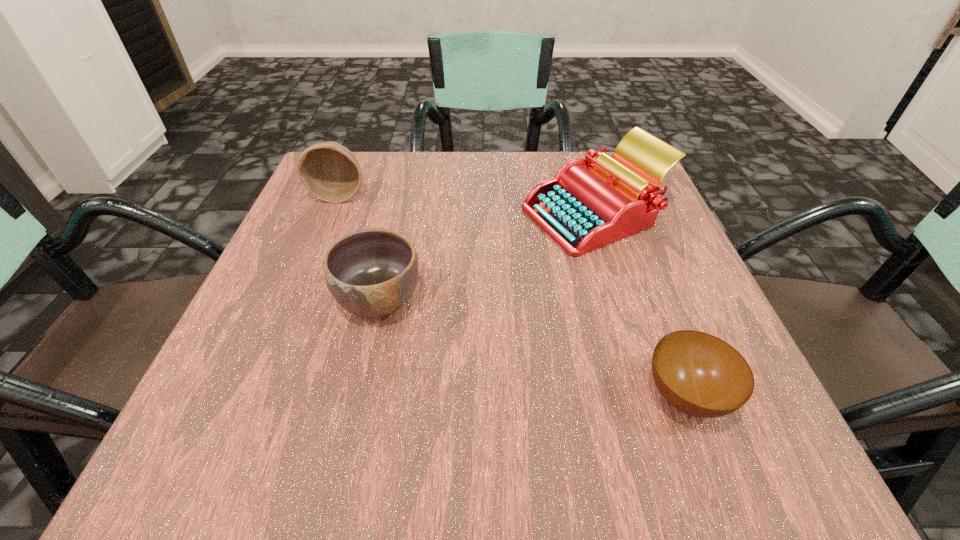
Where is `object situated at the near right corner`? The height and width of the screenshot is (540, 960). object situated at the near right corner is located at coordinates [x=699, y=374].

You are a GUI agent. You are given a task and a screenshot of the screen. Output one action in this format:
    pyautogui.click(x=<x>, y=<y>)
    Task: Click on the blank area at the far edge
    The height and width of the screenshot is (540, 960).
    Given the screenshot: What is the action you would take?
    pyautogui.click(x=542, y=155)

The image size is (960, 540). Find the location of `blank space at the near edge of the desktop`. blank space at the near edge of the desktop is located at coordinates (433, 440).

Where is `vacant area at the left edge`? vacant area at the left edge is located at coordinates (280, 319).

At what (x,y) coordinates should I click in order to perform the action: click on free space at the near left corner of the desktop. Please return your answer as a coordinate pair (x, y). Looking at the image, I should click on [x=182, y=466].

This screenshot has width=960, height=540. I want to click on vacant space at the near right corner of the desktop, so click(x=802, y=478).

Where is `free space that is in between the rightmost bowl and the second bowl from right to left`? The image size is (960, 540). free space that is in between the rightmost bowl and the second bowl from right to left is located at coordinates (533, 348).

You are a GUI agent. You are given a task and a screenshot of the screen. Output one action in this format:
    pyautogui.click(x=<x>, y=<y>)
    Task: Click on the empty space that is in between the shortest object and the typewriter
    
    Given the screenshot: What is the action you would take?
    pyautogui.click(x=640, y=306)

Find the location of a particular element. The width and height of the screenshot is (960, 540). free space between the rightmost bowl and the second farthest bowl is located at coordinates (533, 348).

You are a GUI agent. You are given a task and a screenshot of the screen. Output one action in this format:
    pyautogui.click(x=<x>, y=<y>)
    Task: Click on the empty space between the second nearest object and the typewriter
    
    Given the screenshot: What is the action you would take?
    pyautogui.click(x=487, y=258)